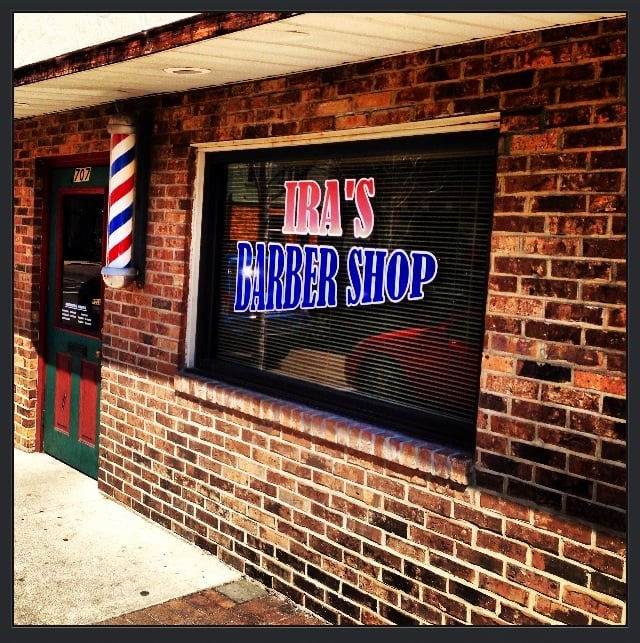
Identify the location of bottom of door. This screenshot has height=643, width=640. (77, 458).